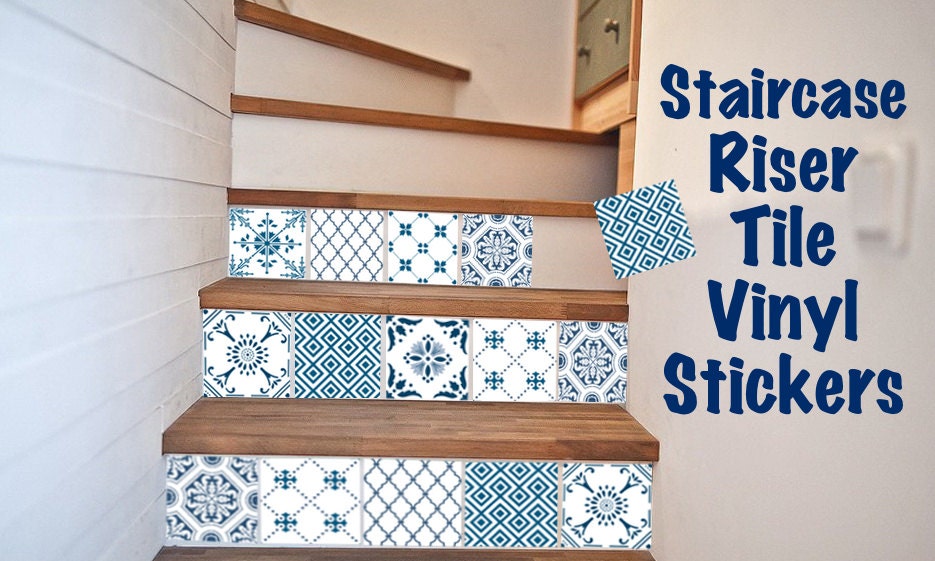
Locate an element on the screen. wall made with drywall is located at coordinates (822, 35).